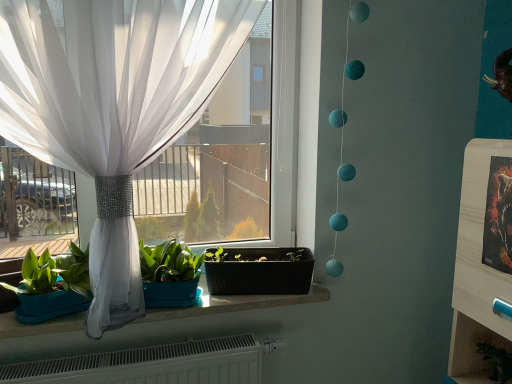
Question: Can you confirm if wooden shelf at lower right is wider than matte white stone window sill at center?

Choices:
 (A) no
 (B) yes

Answer: (B)

Question: From the image's perspective, is wooden shelf at lower right located beneath matte white stone window sill at center?

Choices:
 (A) yes
 (B) no

Answer: (A)

Question: Is the depth of wooden shelf at lower right greater than that of matte white stone window sill at center?

Choices:
 (A) no
 (B) yes

Answer: (A)

Question: Is wooden shelf at lower right completely or partially outside of matte white stone window sill at center?

Choices:
 (A) yes
 (B) no

Answer: (A)

Question: Considering the relative positions of wooden shelf at lower right and matte white stone window sill at center in the image provided, is wooden shelf at lower right to the left of matte white stone window sill at center from the viewer's perspective?

Choices:
 (A) no
 (B) yes

Answer: (A)

Question: Is wooden shelf at lower right positioned before matte white stone window sill at center?

Choices:
 (A) no
 (B) yes

Answer: (B)

Question: Can you confirm if white sheer curtain at left is smaller than wooden shelf at lower right?

Choices:
 (A) yes
 (B) no

Answer: (B)

Question: Is wooden shelf at lower right inside white sheer curtain at left?

Choices:
 (A) yes
 (B) no

Answer: (B)

Question: Can you confirm if white sheer curtain at left is wider than wooden shelf at lower right?

Choices:
 (A) no
 (B) yes

Answer: (A)

Question: Is white sheer curtain at left facing towards wooden shelf at lower right?

Choices:
 (A) no
 (B) yes

Answer: (A)

Question: Is white sheer curtain at left positioned behind wooden shelf at lower right?

Choices:
 (A) no
 (B) yes

Answer: (A)

Question: Is white sheer curtain at left positioned in front of wooden shelf at lower right?

Choices:
 (A) no
 (B) yes

Answer: (B)

Question: Is metallic gold picture frame at right oriented towards black plastic flowerpot at center?

Choices:
 (A) no
 (B) yes

Answer: (A)